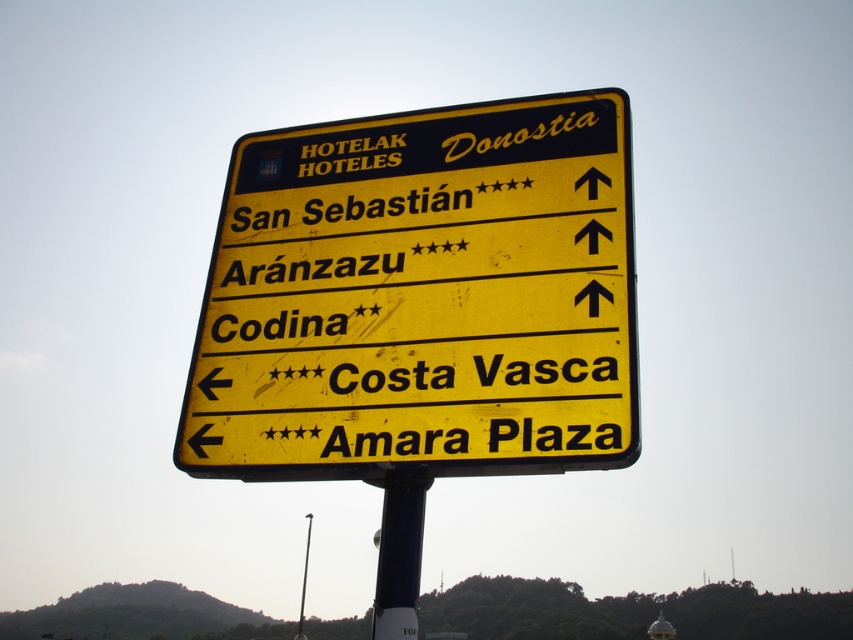
Can you confirm if yellow matte sign at center is bigger than blue metallic pole at center?

Yes.

Measure the distance between point (418, 394) and camera.

Point (418, 394) is 15.89 meters away from camera.

Which is in front, point (225, 273) or point (405, 525)?

Point (405, 525) is in front.

What are the coordinates of `yellow matte sign at center` in the screenshot? It's located at (421, 298).

Does point (397, 577) lie in front of point (308, 540)?

Yes, point (397, 577) is closer to viewer.

Can you confirm if blue metallic pole at center is positioned to the left of metallic pole at center?

Incorrect, blue metallic pole at center is not on the left side of metallic pole at center.

Describe the element at coordinates (399, 556) in the screenshot. The height and width of the screenshot is (640, 853). I see `blue metallic pole at center` at that location.

At what (x,y) coordinates should I click in order to perform the action: click on blue metallic pole at center. Please return your answer as a coordinate pair (x, y). Image resolution: width=853 pixels, height=640 pixels. Looking at the image, I should click on (399, 556).

Is yellow matte sign at center to the left of metallic pole at center from the viewer's perspective?

No, yellow matte sign at center is not to the left of metallic pole at center.

Is yellow matte sign at center shorter than metallic pole at center?

Yes.

At what (x,y) coordinates should I click in order to perform the action: click on yellow matte sign at center. Please return your answer as a coordinate pair (x, y). The image size is (853, 640). Looking at the image, I should click on (421, 298).